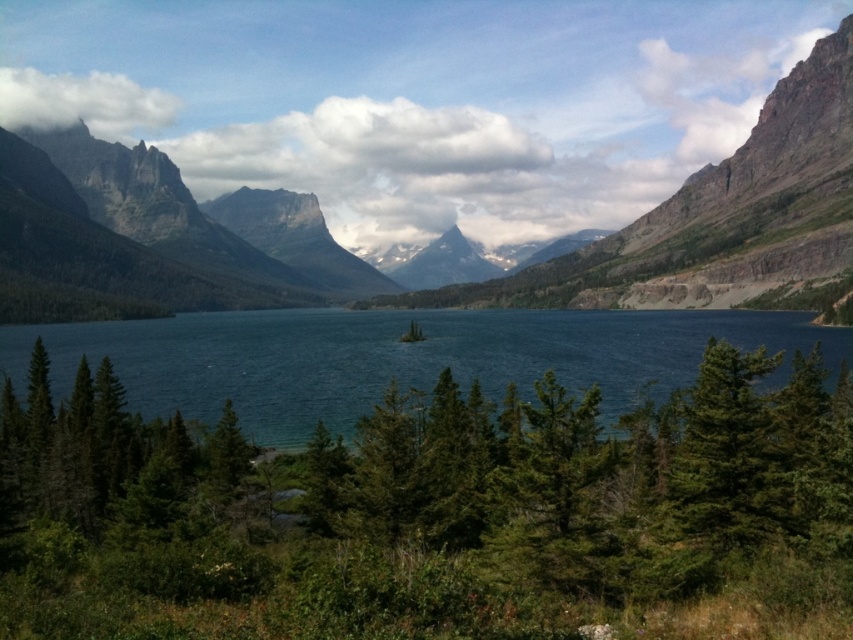
Does green matte tree at center have a larger size compared to green matte tree at lower right?

Yes.

Between green matte tree at center and green matte tree at lower right, which one has more height?

With more height is green matte tree at center.

Is point (474, 605) positioned after point (769, 356)?

No, it is not.

What are the coordinates of `green matte tree at center` in the screenshot? It's located at (x=422, y=508).

Measure the distance between point (x=712, y=61) and camera.

777.79 meters

Is rugged granite mountain at left wider than green matte tree at lower right?

Correct, the width of rugged granite mountain at left exceeds that of green matte tree at lower right.

Is point (654, 102) positioned in front of point (747, 371)?

No, (654, 102) is behind (747, 371).

You are a GUI agent. You are given a task and a screenshot of the screen. Output one action in this format:
    pyautogui.click(x=<x>, y=<y>)
    Task: Click on the rugged granite mountain at left
    The image size is (853, 640).
    Given the screenshot: What is the action you would take?
    pyautogui.click(x=416, y=100)

Between rugged granite mountain at left and blue water at center, which one has more height?

rugged granite mountain at left is taller.

Can you confirm if rugged granite mountain at left is taller than blue water at center?

Yes.

Find the location of a particular element. This screenshot has width=853, height=640. rugged granite mountain at left is located at coordinates (416, 100).